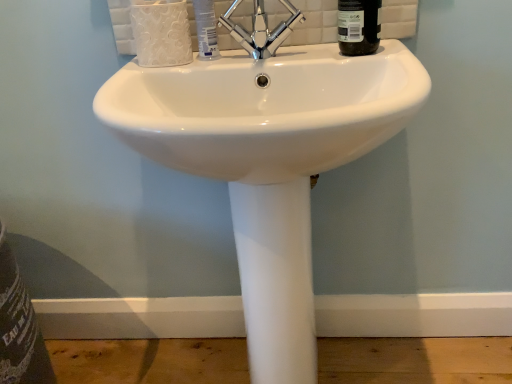
Where is `white plastic tube at center`? The image size is (512, 384). white plastic tube at center is located at coordinates (206, 29).

What is the approximate height of chrome metallic faucet at center?

8.60 inches.

Where is `white ceramic sink at center`? white ceramic sink at center is located at coordinates (268, 161).

From the image's perspective, is black glass bottle at upper right above chrome metallic faucet at center?

Indeed, from the image's perspective, black glass bottle at upper right is shown above chrome metallic faucet at center.

How many degrees apart are the facing directions of black glass bottle at upper right and chrome metallic faucet at center?

The facing directions of black glass bottle at upper right and chrome metallic faucet at center are 2.66 degrees apart.

Is black glass bottle at upper right situated inside chrome metallic faucet at center or outside?

black glass bottle at upper right lies outside chrome metallic faucet at center.

Between point (375, 46) and point (255, 16), which one is positioned in front?

The point (375, 46) is closer.

Consider the image. Between chrome metallic faucet at center and black glass bottle at upper right, which one has more height?

chrome metallic faucet at center is taller.

Would you consider chrome metallic faucet at center to be distant from black glass bottle at upper right?

That's not correct — chrome metallic faucet at center is a little close to black glass bottle at upper right.

Does chrome metallic faucet at center come behind black glass bottle at upper right?

No, the depth of chrome metallic faucet at center is less than that of black glass bottle at upper right.

Can black glass bottle at upper right be found inside chrome metallic faucet at center?

No, black glass bottle at upper right is not a part of chrome metallic faucet at center.

Would you say white plastic tube at center is inside or outside black glass bottle at upper right?

The correct answer is: outside.

Considering their positions, is white plastic tube at center located in front of or behind black glass bottle at upper right?

white plastic tube at center is positioned farther from the viewer than black glass bottle at upper right.

How different are the orientations of white plastic tube at center and black glass bottle at upper right in degrees?

5.92 degrees separate the facing orientations of white plastic tube at center and black glass bottle at upper right.

Can you confirm if chrome metallic faucet at center is positioned to the left of white plastic tube at center?

In fact, chrome metallic faucet at center is to the right of white plastic tube at center.

From a real-world perspective, which is physically below, chrome metallic faucet at center or white plastic tube at center?

From a 3D spatial view, white plastic tube at center is below.

Is chrome metallic faucet at center turned away from white plastic tube at center?

No, white plastic tube at center is not at the back of chrome metallic faucet at center.

The height and width of the screenshot is (384, 512). I want to click on tap on the left of the white ceramic sink at center, so click(x=261, y=29).

From the image's perspective, is white ceramic sink at center on top of chrome metallic faucet at center?

No, from the image's perspective, white ceramic sink at center is not above chrome metallic faucet at center.

Can you confirm if white ceramic sink at center is taller than chrome metallic faucet at center?

Yes, white ceramic sink at center is taller than chrome metallic faucet at center.

Does white plastic tube at center turn towards chrome metallic faucet at center?

No, white plastic tube at center does not turn towards chrome metallic faucet at center.

Is white plastic tube at center not inside chrome metallic faucet at center?

Yes, white plastic tube at center is not within chrome metallic faucet at center.

How many degrees apart are the facing directions of white plastic tube at center and chrome metallic faucet at center?

There is a 3.26-degree angle between the facing directions of white plastic tube at center and chrome metallic faucet at center.

How much distance is there between white plastic tube at center and chrome metallic faucet at center?

The distance of white plastic tube at center from chrome metallic faucet at center is 8.12 centimeters.

Looking at this image, between white plastic tube at center and white ceramic sink at center, which one has more height?

Standing taller between the two is white ceramic sink at center.

Which of these two, white plastic tube at center or white ceramic sink at center, is thinner?

white plastic tube at center is thinner.

From a real-world perspective, is white plastic tube at center located beneath white ceramic sink at center?

No, from a real-world perspective, white plastic tube at center is not beneath white ceramic sink at center.

Which is in front, white plastic tube at center or white ceramic sink at center?

Positioned in front is white ceramic sink at center.

In order to click on liquid on the right of chrome metallic faucet at center in this screenshot , I will do `click(358, 27)`.

The width and height of the screenshot is (512, 384). In the image, there is a chrome metallic faucet at center. Find the location of `liquid below it (from a real-world perspective)`. liquid below it (from a real-world perspective) is located at coordinates (358, 27).

From the image, which object appears to be nearer to white ceramic sink at center, white plastic tube at center or black glass bottle at upper right?

Based on the image, black glass bottle at upper right appears to be nearer to white ceramic sink at center.

Estimate the real-world distances between objects in this image. Which object is closer to chrome metallic faucet at center, white ceramic sink at center or white plastic tube at center?

white plastic tube at center is positioned closer to the anchor chrome metallic faucet at center.

Looking at the image, which one is located further to white plastic tube at center, white ceramic sink at center or chrome metallic faucet at center?

Among the two, white ceramic sink at center is located further to white plastic tube at center.

Based on their spatial positions, is white plastic tube at center or white ceramic sink at center further from black glass bottle at upper right?

white ceramic sink at center lies further to black glass bottle at upper right than the other object.

Looking at the image, which one is located closer to white plastic tube at center, white ceramic sink at center or black glass bottle at upper right?

Among the two, black glass bottle at upper right is located nearer to white plastic tube at center.

Which object lies nearer to the anchor point white ceramic sink at center, chrome metallic faucet at center or white plastic tube at center?

The object closer to white ceramic sink at center is chrome metallic faucet at center.

Which object lies nearer to the anchor point black glass bottle at upper right, chrome metallic faucet at center or white plastic tube at center?

chrome metallic faucet at center.

From the image, which object appears to be nearer to chrome metallic faucet at center, black glass bottle at upper right or white plastic tube at center?

white plastic tube at center lies closer to chrome metallic faucet at center than the other object.

This screenshot has height=384, width=512. I want to click on tap that lies between black glass bottle at upper right and white ceramic sink at center from top to bottom, so click(x=261, y=29).

This screenshot has height=384, width=512. Find the location of `tap that lies between white plastic tube at center and white ceramic sink at center from top to bottom`. tap that lies between white plastic tube at center and white ceramic sink at center from top to bottom is located at coordinates (261, 29).

Identify the location of toiletry between black glass bottle at upper right and white ceramic sink at center from top to bottom. (206, 29).

I want to click on tap between white plastic tube at center and black glass bottle at upper right, so tap(261, 29).